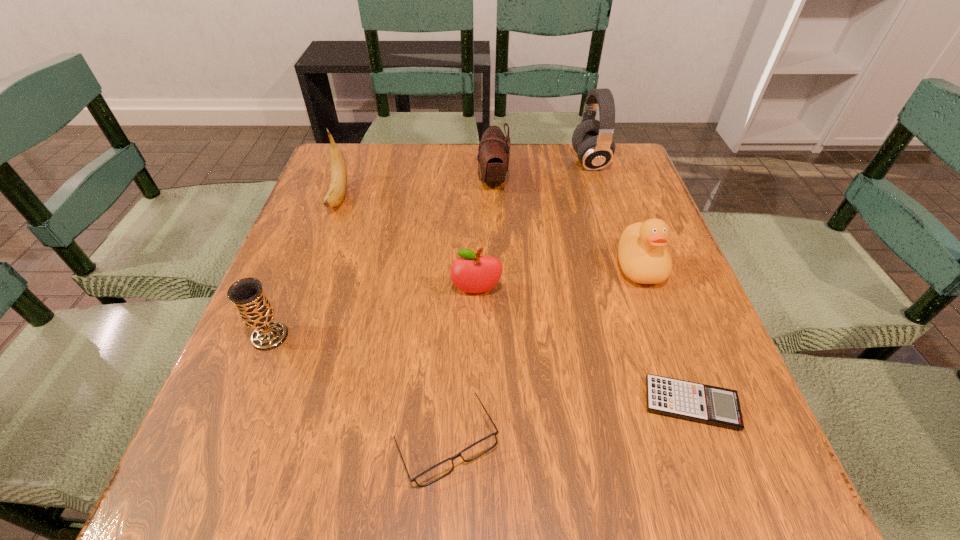
Where is `vacant area that lies between the duck and the tallest object`? vacant area that lies between the duck and the tallest object is located at coordinates (614, 214).

The height and width of the screenshot is (540, 960). Find the location of `unoccupied area between the pouch and the sixth farthest object`. unoccupied area between the pouch and the sixth farthest object is located at coordinates (381, 258).

Image resolution: width=960 pixels, height=540 pixels. What are the coordinates of `vacant space that is in between the second shortest object and the banana` in the screenshot? It's located at click(393, 320).

I want to click on vacant space that's between the pouch and the chalice, so click(x=381, y=258).

Where is `blank region between the headset and the pouch`? blank region between the headset and the pouch is located at coordinates (541, 171).

Where is `free space between the duck and the apple`? free space between the duck and the apple is located at coordinates (558, 279).

Identify the location of object identified as the fifth closest to the chalice. Image resolution: width=960 pixels, height=540 pixels. (708, 404).

Identify the location of object that stands as the second closest to the duck. The width and height of the screenshot is (960, 540). (472, 273).

In order to click on free space that satisfies the following two spatial constraints: 1. at the start of the peel on the banana; 2. on the right side of the shortest object in this screenshot , I will do `click(262, 403)`.

This screenshot has height=540, width=960. In order to click on free spot that satisfies the following two spatial constraints: 1. on the ear cups of the headset; 2. with the lenses facing outward on the seventh tallest object in this screenshot , I will do `click(680, 443)`.